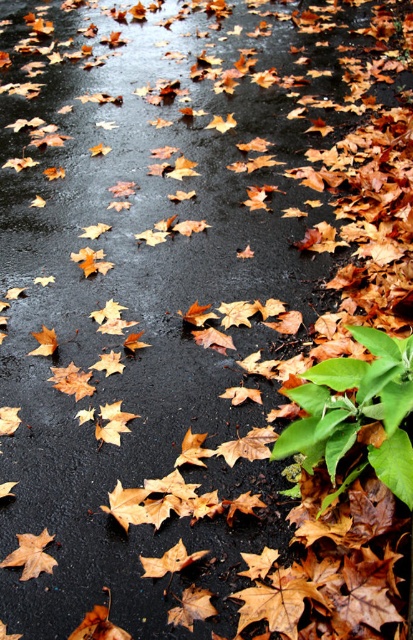
Where is `brown matte maple leaf at lower left`? The height and width of the screenshot is (640, 413). brown matte maple leaf at lower left is located at coordinates (30, 554).

Who is positioned more to the left, brown matte maple leaf at lower left or orange matte maple leaf at lower left?

From the viewer's perspective, brown matte maple leaf at lower left appears more on the left side.

The width and height of the screenshot is (413, 640). I want to click on brown matte maple leaf at lower left, so click(x=30, y=554).

Where is `brown matte maple leaf at lower left`? This screenshot has height=640, width=413. brown matte maple leaf at lower left is located at coordinates (30, 554).

Measure the distance from brown matte maple leaf at lower center to orange matte maple leaf at center.

A distance of 19.12 centimeters exists between brown matte maple leaf at lower center and orange matte maple leaf at center.

Does brown matte maple leaf at lower center have a smaller size compared to orange matte maple leaf at center?

Incorrect, brown matte maple leaf at lower center is not smaller in size than orange matte maple leaf at center.

Who is more forward, (261, 596) or (159, 561)?

Point (261, 596) is in front.

Identify the location of brown matte maple leaf at lower center. (279, 600).

Which is in front, point (273, 573) or point (128, 516)?

Point (273, 573) is in front.

In the scene shown: Can you confirm if brown matte maple leaf at lower center is positioned to the left of orange matte maple leaf at lower left?

In fact, brown matte maple leaf at lower center is to the right of orange matte maple leaf at lower left.

Between point (272, 608) and point (146, 513), which one is positioned in front?

Point (272, 608) is more forward.

Identify the location of brown matte maple leaf at lower center. (279, 600).